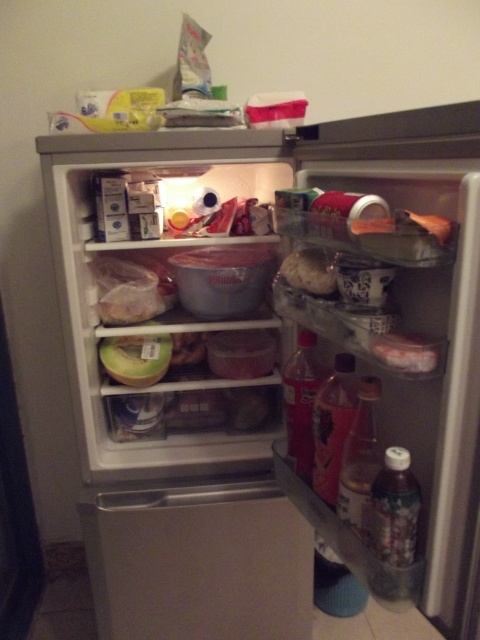
You are organizing the fridge and need to place a new item between the translucent plastic soda at center and the translucent plastic container at center. Which side of the soda should you place the new item to ensure it fits better?

Since the translucent plastic soda at center is wider than the translucent plastic container at center, placing the new item on the side of the soda would allow more space for the wider item. However, since both are at the center, you might need to adjust their positions to accommodate the new item properly.

Consider the image. You are standing in front of the refrigerator and want to reach two points inside the fridge. The first point is at coordinates point (420,499) and the second point is at point (384,346). Which point is closer to you?

Point (420,499) is further to the camera than point (384,346), so the second point is closer to you.